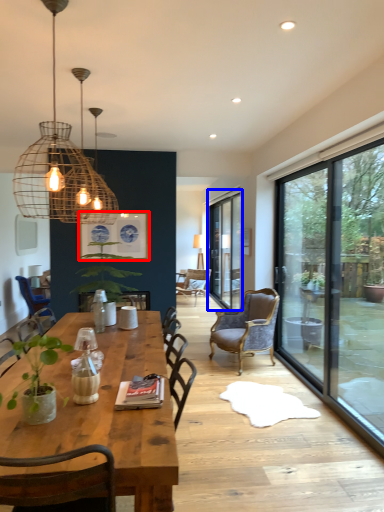
Question: Which object is further to the camera taking this photo, picture frame (highlighted by a red box) or window (highlighted by a blue box)?

Choices:
 (A) picture frame
 (B) window

Answer: (B)